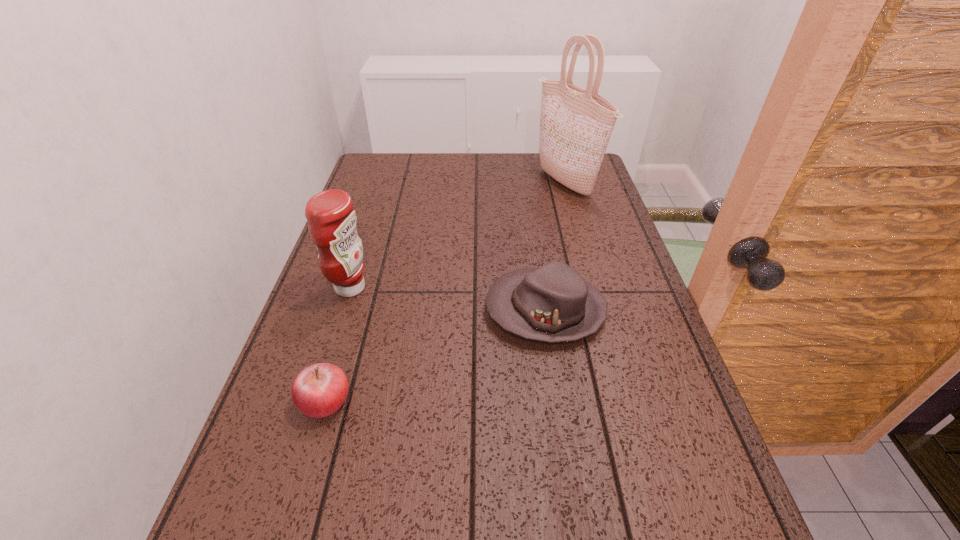
The image size is (960, 540). Find the location of `vacant space that is in between the hat and the shopping bag`. vacant space that is in between the hat and the shopping bag is located at coordinates (556, 247).

I want to click on blank region between the hat and the apple, so click(435, 356).

This screenshot has width=960, height=540. Find the location of `vacant area that lies between the nearest object and the shopping bag`. vacant area that lies between the nearest object and the shopping bag is located at coordinates (445, 293).

The height and width of the screenshot is (540, 960). Identify the location of free spot between the apple and the tallest object. (445, 293).

Locate an element on the screen. free spot between the farthest object and the nearest object is located at coordinates (445, 293).

Locate an element on the screen. Image resolution: width=960 pixels, height=540 pixels. vacant point located between the farthest object and the hat is located at coordinates (556, 247).

Identify the location of free space between the third shortest object and the hat. (447, 299).

Where is `vacant point located between the hat and the second tallest object`? The height and width of the screenshot is (540, 960). vacant point located between the hat and the second tallest object is located at coordinates pos(447,299).

Locate an element on the screen. unoccupied position between the hat and the second tallest object is located at coordinates (447, 299).

At what (x,y) coordinates should I click in order to perform the action: click on vacant space in between the hat and the farthest object. Please return your answer as a coordinate pair (x, y). Image resolution: width=960 pixels, height=540 pixels. Looking at the image, I should click on (556, 247).